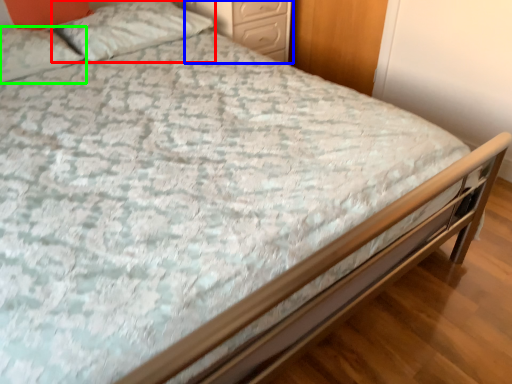
Question: Which object is positioned farthest from pillow (highlighted by a red box)? Select from nightstand (highlighted by a blue box) and pillow (highlighted by a green box).

Choices:
 (A) nightstand
 (B) pillow

Answer: (A)